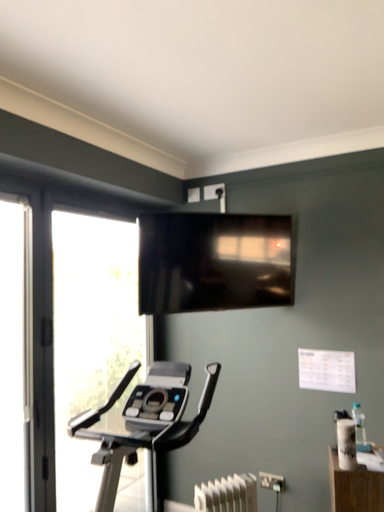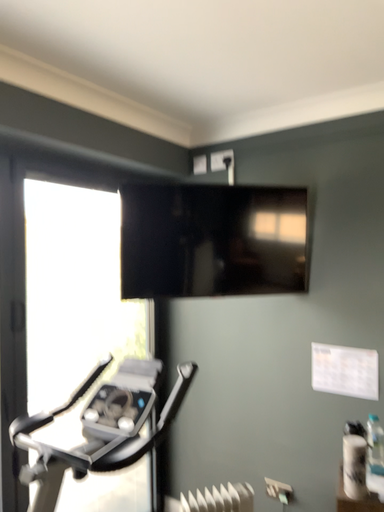
Question: How did the camera likely rotate when shooting the video?

Choices:
 (A) rotated left
 (B) rotated right

Answer: (A)